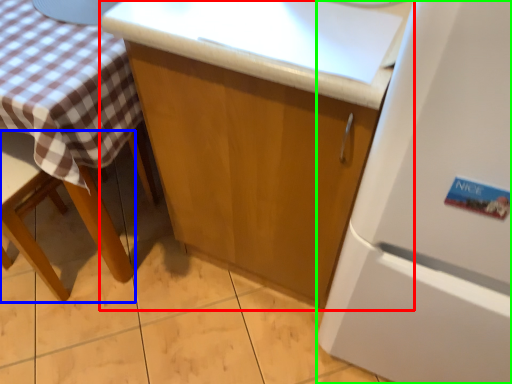
Question: Considering the real-world distances, which object is farthest from cabinetry (highlighted by a red box)? chair (highlighted by a blue box) or refrigerator (highlighted by a green box)?

Choices:
 (A) chair
 (B) refrigerator

Answer: (A)